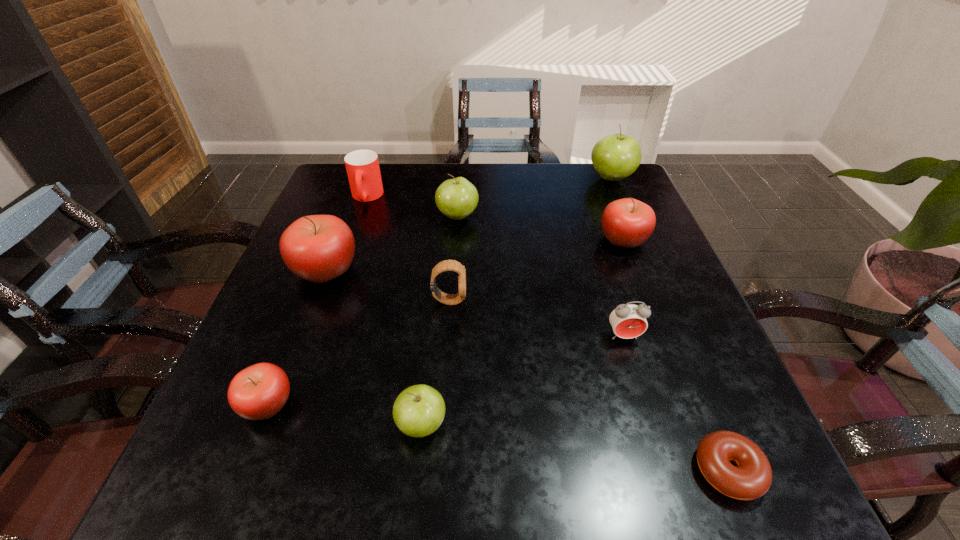
Find the location of `the smallest red apple`. the smallest red apple is located at coordinates (258, 392).

Where is `chocolate doughnut`? This screenshot has width=960, height=540. chocolate doughnut is located at coordinates (752, 478).

This screenshot has height=540, width=960. What are the coordinates of `the shortest object` in the screenshot? It's located at (752, 478).

Find the location of a particular element. Image resolution: width=960 pixels, height=540 pixels. vacant space situated 0.060m on the left of the farthest apple is located at coordinates (566, 178).

At what (x,y) coordinates should I click in order to perform the action: click on vacant space located 0.400m on the front of the biggest red apple. Please return your answer as a coordinate pair (x, y). Looking at the image, I should click on (241, 491).

Find the location of a particular element. The height and width of the screenshot is (540, 960). vacant space located 0.110m on the right of the second biggest green apple is located at coordinates (522, 217).

You are a GUI agent. You are given a task and a screenshot of the screen. Output one action in this format:
    pyautogui.click(x=<x>, y=<y>)
    Task: Click on the vacant space located 0.130m on the back of the second biggest red apple
    The height and width of the screenshot is (540, 960).
    Given the screenshot: What is the action you would take?
    pyautogui.click(x=607, y=197)

Locate an element on the screen. Image resolution: width=960 pixels, height=540 pixels. vacant space located 0.220m on the side of the red cup with the handle is located at coordinates (344, 266).

The height and width of the screenshot is (540, 960). Identify the location of vacant area situated 0.260m on the face of the watch. (592, 300).

At what (x,y) coordinates should I click in order to perform the action: click on free space located 0.190m on the face of the alarm clock. Please return your answer as a coordinate pair (x, y). Looking at the image, I should click on (656, 440).